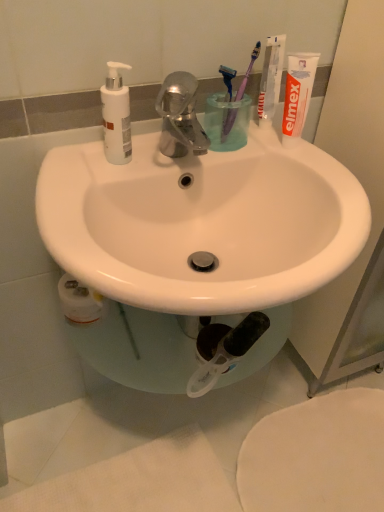
Identify the location of free point below white matte bidet at lower right (from a real-world perspective). (316, 458).